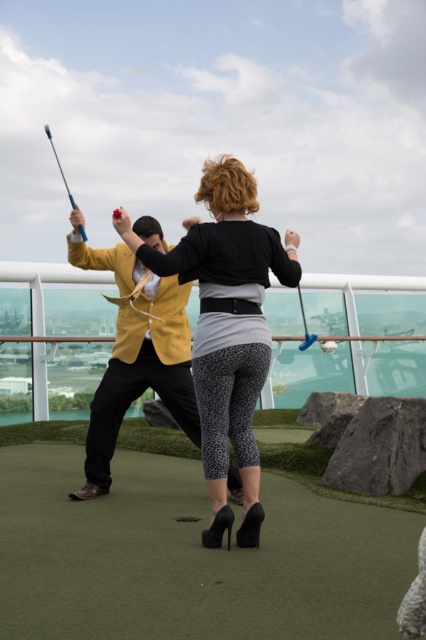
Question: Which object is positioned farthest from the black textured leggings at center?

Choices:
 (A) yellow fabric jacket at left
 (B) blue plastic fishing pole at upper left

Answer: (B)

Question: Is green artificial turf at center smaller than black textured leggings at center?

Choices:
 (A) yes
 (B) no

Answer: (A)

Question: Which is nearer to the yellow fabric jacket at left?

Choices:
 (A) blue plastic fishing pole at upper left
 (B) black textured leggings at center
 (C) green artificial turf at center

Answer: (B)

Question: Is green artificial turf at center in front of black textured leggings at center?

Choices:
 (A) yes
 (B) no

Answer: (B)

Question: Can you confirm if green artificial turf at center is positioned to the right of blue plastic fishing pole at upper left?

Choices:
 (A) no
 (B) yes

Answer: (B)

Question: Among these objects, which one is nearest to the camera?

Choices:
 (A) blue plastic fishing pole at upper left
 (B) black textured leggings at center
 (C) green artificial turf at center

Answer: (B)